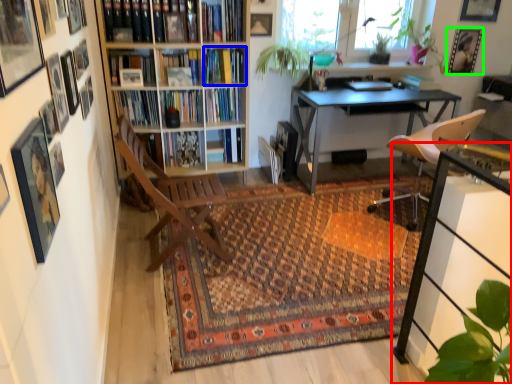
Question: Which is nearer to the table (highlighted by a red box)? book (highlighted by a blue box) or picture frame (highlighted by a green box).

Choices:
 (A) book
 (B) picture frame

Answer: (A)